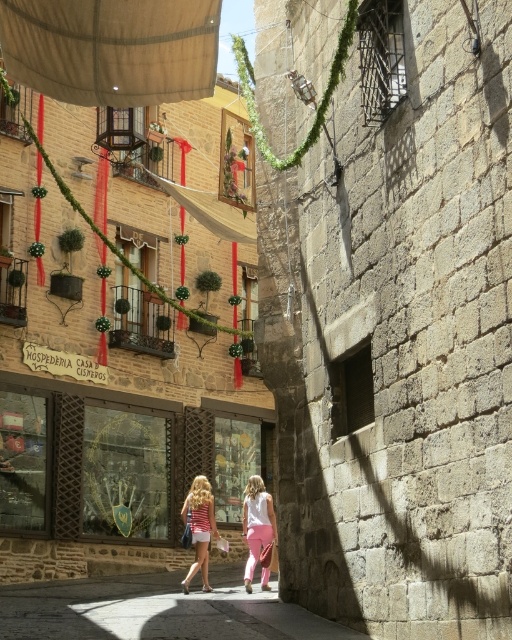
Question: Which point is closer to the camera?

Choices:
 (A) (261, 536)
 (B) (206, 518)

Answer: (A)

Question: Which point is closer to the camera?

Choices:
 (A) (196, 548)
 (B) (266, 516)
 (C) (55, 77)

Answer: (C)

Question: In this image, where is beige canvas awning at upper center located relative to matte pink pants at center?

Choices:
 (A) right
 (B) left

Answer: (B)

Question: Does beige canvas awning at upper center appear over matte pink pants at center?

Choices:
 (A) yes
 (B) no

Answer: (A)

Question: Can you confirm if beige canvas awning at upper center is positioned above striped fabric dress at center?

Choices:
 (A) yes
 (B) no

Answer: (A)

Question: Among these points, which one is farthest from the camera?

Choices:
 (A) (205, 518)
 (B) (263, 548)
 (C) (176, 35)

Answer: (A)